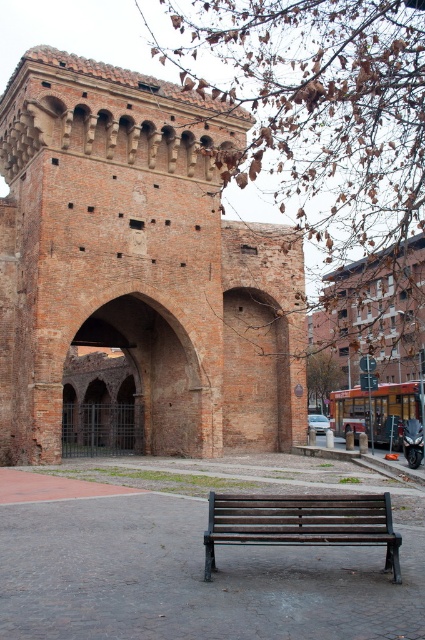
You are a tourist standing at the entrance of the historical site and want to take a photo of the brick archway at center while sitting on the wooden bench at center. Can you comfortably take the photo without moving from the bench?

The brick archway at center and wooden bench at center are 29.81 meters apart from each other. Since this distance is quite large, you can comfortably take the photo while sitting on the wooden bench at center without needing to move.

Looking at this image, you are standing at the point marked by the coordinate point (x=138, y=264). Based on the scene description, what architectural feature are you directly facing?

The point (x=138, y=264) marks the brick and tiled fort at center, so you are directly facing the brick and tiled fort at center.